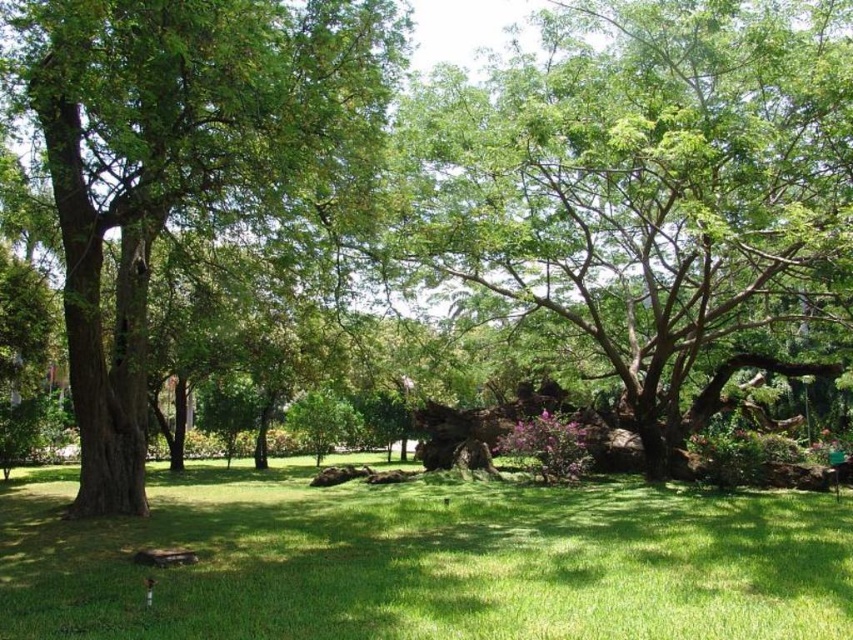
You are standing in the park and want to take a photo of the green leafy tree at center. If you are currently at the coordinates of point 0, where should you move to frame the tree properly?

The green leafy tree at center is located at point (648, 186), so you should move to that coordinate to frame it properly.